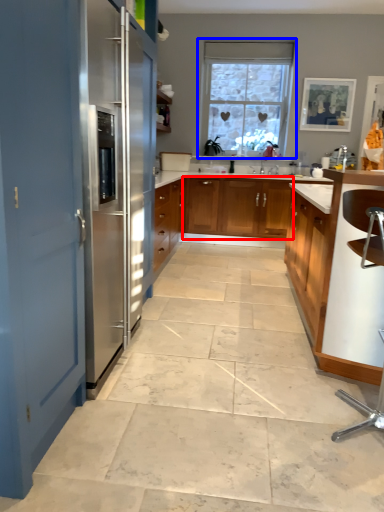
Question: Which of the following is the closest to the observer, cabinetry (highlighted by a red box) or window (highlighted by a blue box)?

Choices:
 (A) cabinetry
 (B) window

Answer: (A)